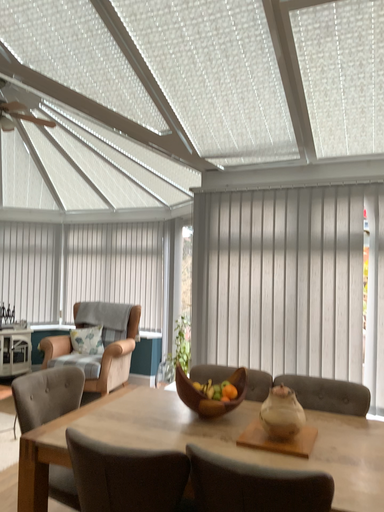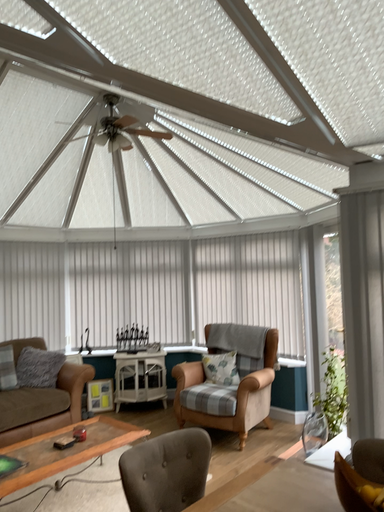
Question: Which way did the camera rotate in the video?

Choices:
 (A) rotated left
 (B) rotated right

Answer: (A)